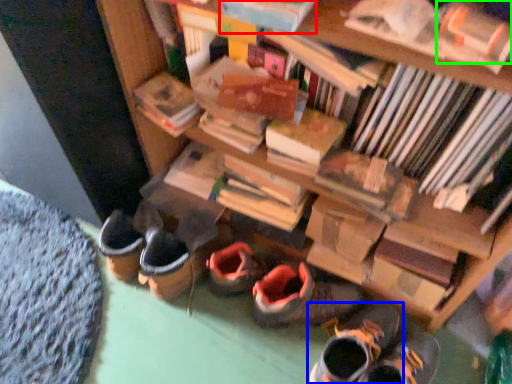
Question: Which is farther away from book (highlighted by a red box)? footwear (highlighted by a blue box) or book (highlighted by a green box)?

Choices:
 (A) footwear
 (B) book

Answer: (A)